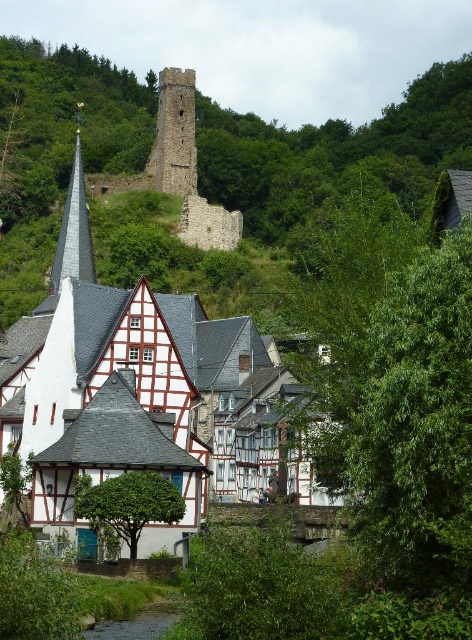
Consider the image. Does white half-timbered houses at center have a smaller size compared to brown stone tower at upper center?

No.

Who is lower down, white half-timbered houses at center or brown stone tower at upper center?

white half-timbered houses at center is below.

Measure the distance between point (167,336) and camera.

The distance of point (167,336) from camera is 75.93 meters.

You are a GUI agent. You are given a task and a screenshot of the screen. Output one action in this format:
    pyautogui.click(x=<x>, y=<y>)
    Task: Click on the white half-timbered houses at center
    
    Given the screenshot: What is the action you would take?
    pyautogui.click(x=132, y=388)